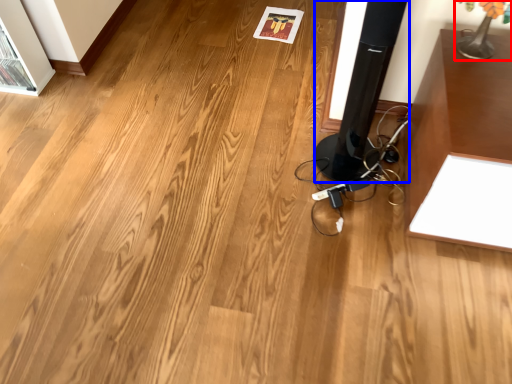
Question: Which of the following is the closest to the observer, table lamp (highlighted by a red box) or speaker (highlighted by a blue box)?

Choices:
 (A) table lamp
 (B) speaker

Answer: (B)